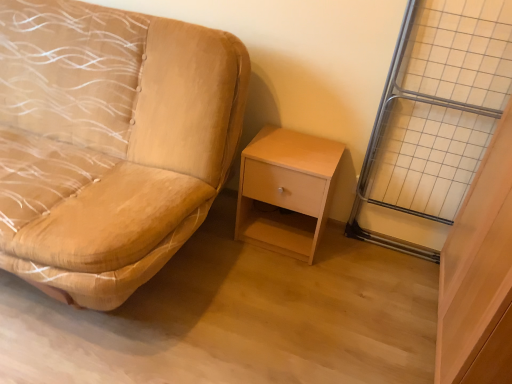
Find the location of a particular element. The width and height of the screenshot is (512, 384). vacant space to the right of light wood/finely finished nightstand at center-right is located at coordinates (348, 261).